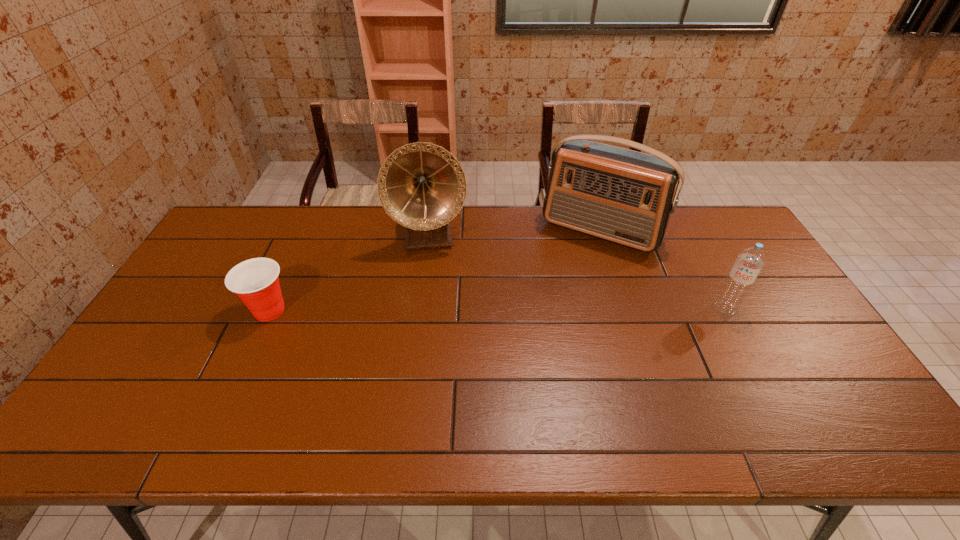
Where is `vacant space on the desktop that is between the leftmost object and the second shortest object and is positioned on the horn of the phonograph record`? This screenshot has width=960, height=540. vacant space on the desktop that is between the leftmost object and the second shortest object and is positioned on the horn of the phonograph record is located at coordinates (436, 310).

This screenshot has width=960, height=540. In order to click on free space on the desktop that is between the cup and the rightmost object and is positioned on the front-facing side of the radio receiver in this screenshot , I will do `click(557, 309)`.